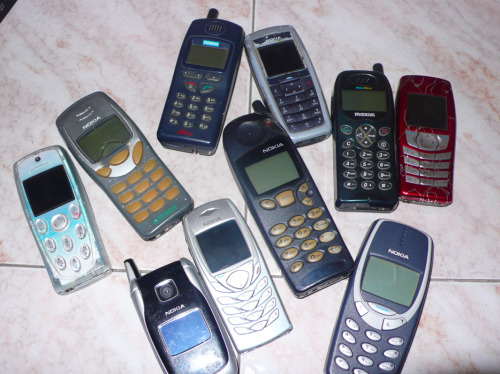
This screenshot has width=500, height=374. Identify the location of tile. (95, 363), (99, 64), (411, 31), (472, 325).